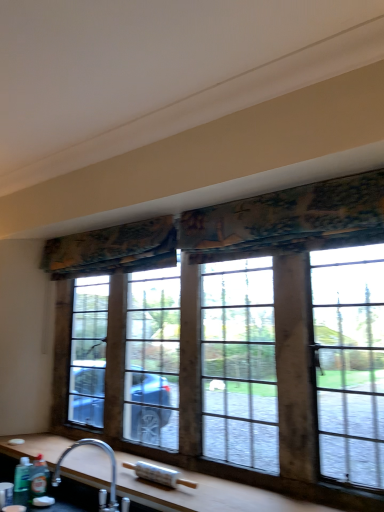
At what (x,y) coordinates should I click in order to perform the action: click on vacant area on top of textured floral fabric at upper center, the first curtain positioned from the right (from a real-world perspective). Please return your answer as a coordinate pair (x, y). This screenshot has width=384, height=512. Looking at the image, I should click on (261, 193).